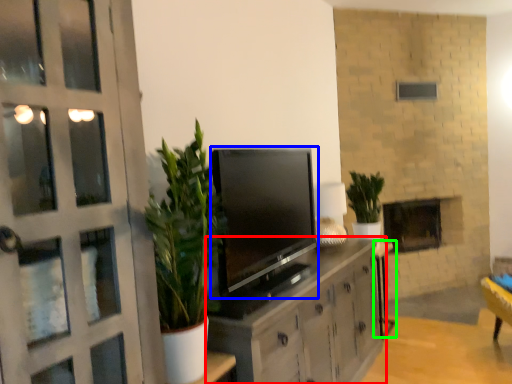
Question: Based on their relative distances, which object is nearer to cabinetry (highlighted by a red box)? Choose from television (highlighted by a blue box) and table (highlighted by a green box).

Choices:
 (A) television
 (B) table

Answer: (A)